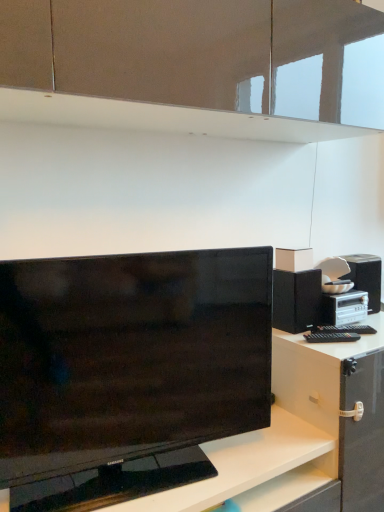
What do you see at coordinates (301, 436) in the screenshot?
I see `black glossy tv at center` at bounding box center [301, 436].

What are the coordinates of `black glossy tv at center` in the screenshot? It's located at (301, 436).

Where is `black matte speaker at right`? black matte speaker at right is located at coordinates (297, 300).

This screenshot has height=512, width=384. What do you see at coordinates (297, 300) in the screenshot? I see `black matte speaker at right` at bounding box center [297, 300].

What is the approximate width of black matte speaker at right?

black matte speaker at right is 4.49 inches in width.

In order to click on black glossy tv at center in this screenshot , I will do `click(301, 436)`.

Between black matte speaker at right and black glossy tv at center, which one appears on the right side from the viewer's perspective?

black matte speaker at right.

Is black matte speaker at right closer to the viewer compared to black glossy tv at center?

That is False.

Considering the points (282, 313) and (277, 459), which point is behind, point (282, 313) or point (277, 459)?

Point (282, 313)

From the image's perspective, is black matte speaker at right located beneath black glossy tv at center?

No, from the image's perspective, black matte speaker at right is not beneath black glossy tv at center.

From a real-world perspective, is black matte speaker at right positioned above or below black glossy tv at center?

black matte speaker at right is above black glossy tv at center.

Considering the sizes of objects black matte speaker at right and black glossy tv at center in the image provided, who is wider, black matte speaker at right or black glossy tv at center?

Wider between the two is black matte speaker at right.

Is black matte speaker at right taller or shorter than black glossy tv at center?

Clearly, black matte speaker at right is shorter compared to black glossy tv at center.

Who is smaller, black matte speaker at right or black glossy tv at center?

With smaller size is black matte speaker at right.

Is black matte speaker at right positioned beyond the bounds of black glossy tv at center?

black matte speaker at right lies outside black glossy tv at center's area.

Looking at this image, is black matte speaker at right with black glossy tv at center?

No, black matte speaker at right is not beside black glossy tv at center.

Is black matte speaker at right looking in the opposite direction of black glossy tv at center?

black matte speaker at right does not have its back to black glossy tv at center.

Can you tell me how much black matte speaker at right and black glossy tv at center differ in facing direction?

There is a 11.6-degree angle between the facing directions of black matte speaker at right and black glossy tv at center.

At what (x,y) coordinates should I click in order to perform the action: click on cabinetry located on the right of black glossy tv at center. Please return your answer as a coordinate pair (x, y). The image size is (384, 512). Looking at the image, I should click on (297, 300).

Can you confirm if black glossy tv at center is positioned to the right of black matte speaker at right?

Incorrect, black glossy tv at center is not on the right side of black matte speaker at right.

Is black glossy tv at center positioned behind black matte speaker at right?

No, black glossy tv at center is in front of black matte speaker at right.

Considering the positions of points (243, 481) and (312, 295), is point (243, 481) closer to camera compared to point (312, 295)?

Yes, it is in front of point (312, 295).

From the image's perspective, is black glossy tv at center above or below black matte speaker at right?

From the image's perspective, black glossy tv at center appears below black matte speaker at right.

From a real-world perspective, is black glossy tv at center positioned under black matte speaker at right based on gravity?

Yes, from a real-world perspective, black glossy tv at center is below black matte speaker at right.

Which of these two, black glossy tv at center or black matte speaker at right, is thinner?

Thinner between the two is black glossy tv at center.

Between black glossy tv at center and black matte speaker at right, which one has less height?

black matte speaker at right is shorter.

Which of these two, black glossy tv at center or black matte speaker at right, is bigger?

Bigger between the two is black glossy tv at center.

Is black matte speaker at right completely or partially inside black glossy tv at center?

Definitely not — black matte speaker at right is not inside black glossy tv at center.

Is black glossy tv at center not near black matte speaker at right?

No, black glossy tv at center is not far from black matte speaker at right.

Based on the photo, is black glossy tv at center oriented away from black matte speaker at right?

No, black matte speaker at right is not at the back of black glossy tv at center.

Can you tell me how much black glossy tv at center and black matte speaker at right differ in facing direction?

The facing directions of black glossy tv at center and black matte speaker at right are 11.6 degrees apart.

Locate an element on the screen. The height and width of the screenshot is (512, 384). desk located below the black matte speaker at right (from the image's perspective) is located at coordinates (301, 436).

You are a GUI agent. You are given a task and a screenshot of the screen. Output one action in this format:
    pyautogui.click(x=<x>, y=<y>)
    Task: Click on the cabinetry above the black glossy tv at center (from a real-world perspective)
    The height and width of the screenshot is (512, 384).
    Given the screenshot: What is the action you would take?
    pyautogui.click(x=297, y=300)

Locate an element on the screen. cabinetry on the right of the black glossy tv at center is located at coordinates (297, 300).